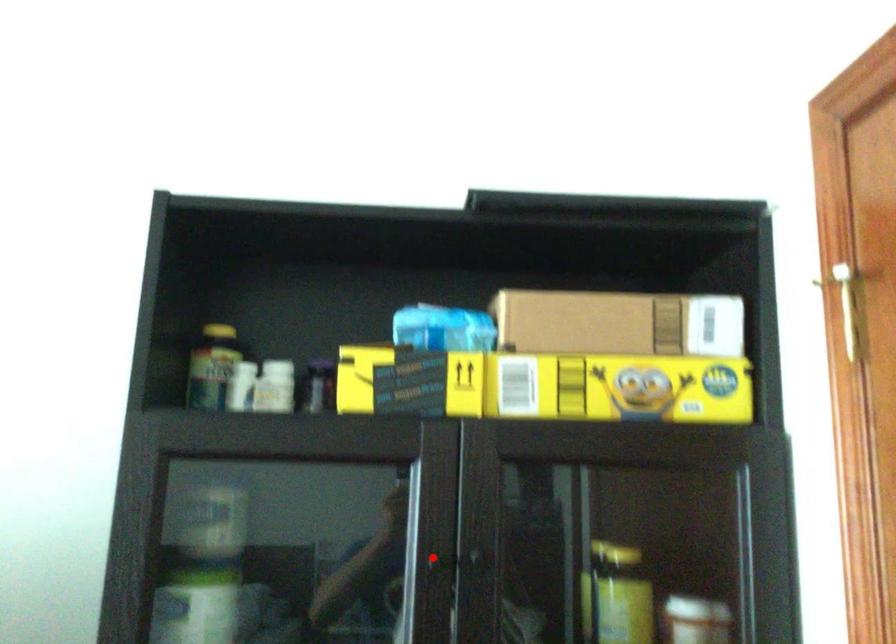
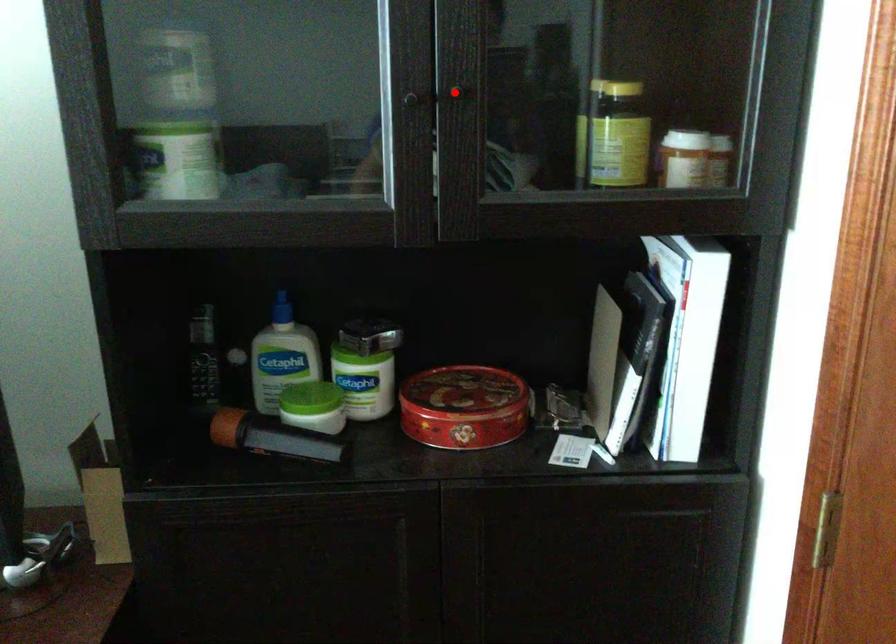
I am providing you with two images of the same scene from different viewpoints. A red point is marked on the first image and another point is marked on the second image. Is the red point in image1 aligned with the point shown in image2?

No